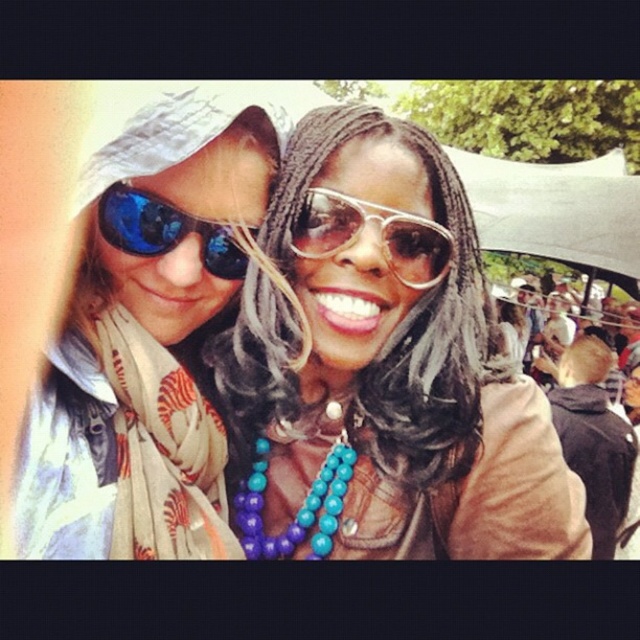
Can you confirm if teal beaded necklace at center is positioned above clear plastic sunglasses at center?

No, teal beaded necklace at center is not above clear plastic sunglasses at center.

Where is `teal beaded necklace at center`? This screenshot has width=640, height=640. teal beaded necklace at center is located at coordinates (x=388, y=364).

Is point (328, 168) in front of point (125, 243)?

No, (328, 168) is further to viewer.

Can you confirm if teal beaded necklace at center is thinner than blue reflective sunglasses at left?

In fact, teal beaded necklace at center might be wider than blue reflective sunglasses at left.

Describe the element at coordinates (388, 364) in the screenshot. I see `teal beaded necklace at center` at that location.

Locate an element on the screen. The height and width of the screenshot is (640, 640). teal beaded necklace at center is located at coordinates (388, 364).

Does clear plastic sunglasses at center have a smaller size compared to turquoise beaded necklace at center?

Yes.

Who is more forward, (323, 236) or (342, 433)?

Point (323, 236) is in front.

Locate an element on the screen. The height and width of the screenshot is (640, 640). clear plastic sunglasses at center is located at coordinates (378, 234).